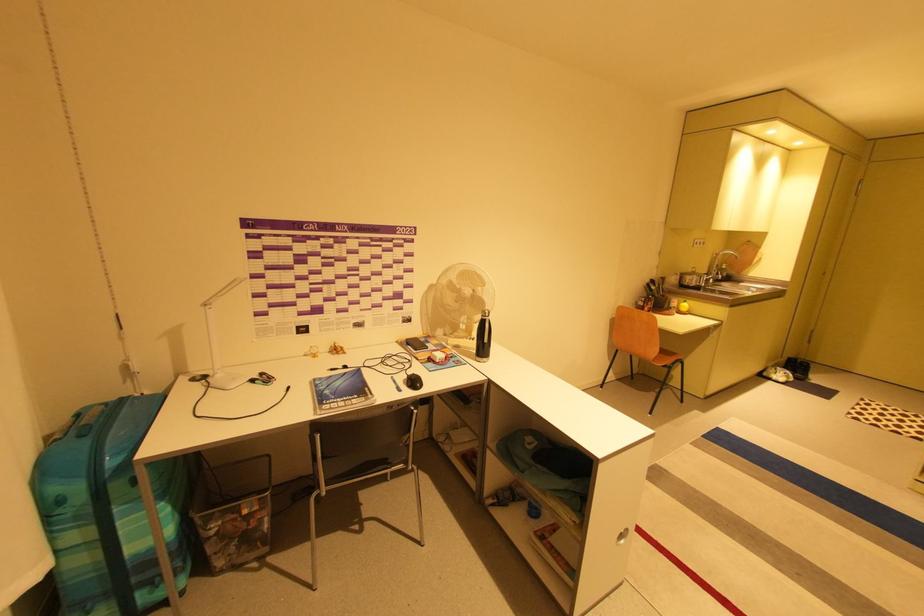
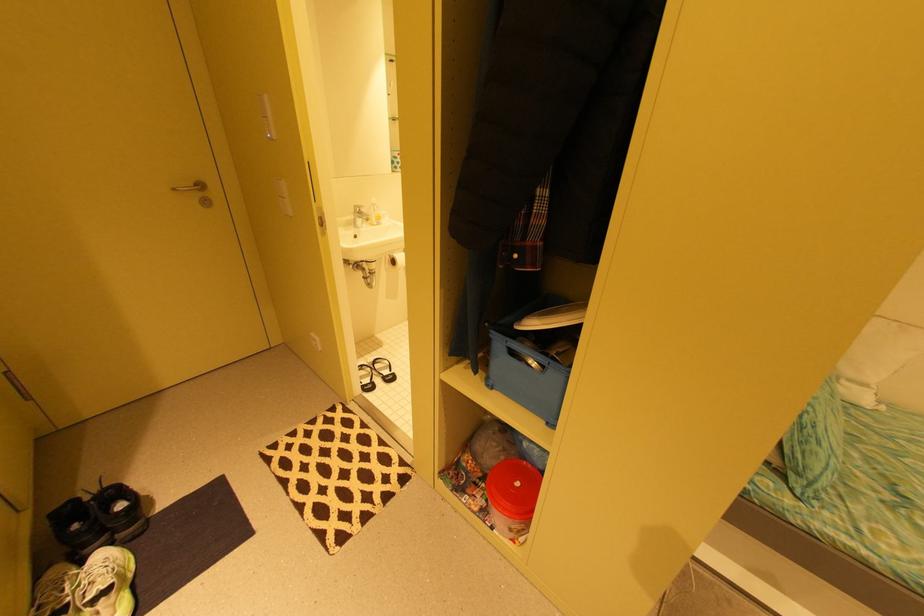
In the second image, find the point that corresponds to point 805,361 in the first image.

(93, 499)